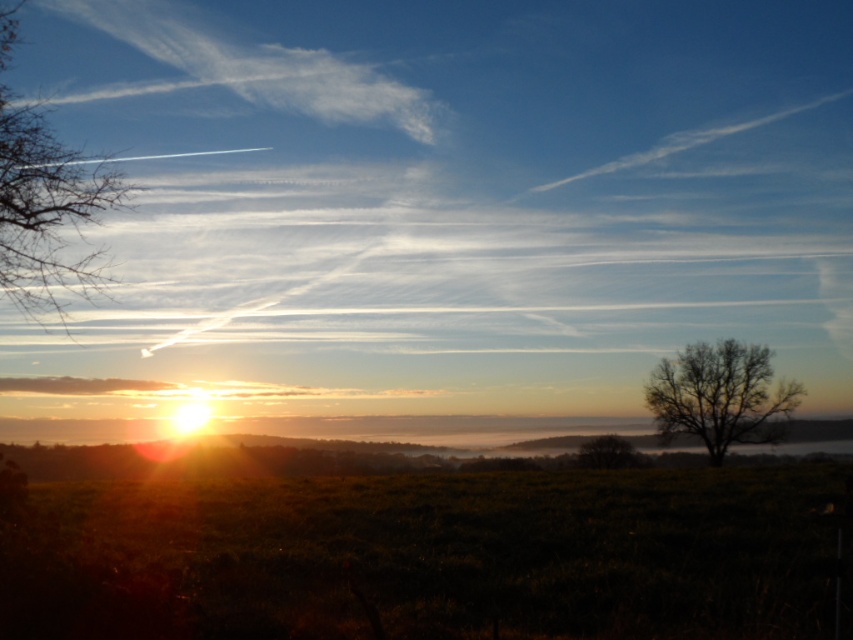
Consider the image. You are standing in the middle of the green grass at center and looking towards the bare branches at right. Which object is taller?

The green grass at center is taller than the bare branches at right.